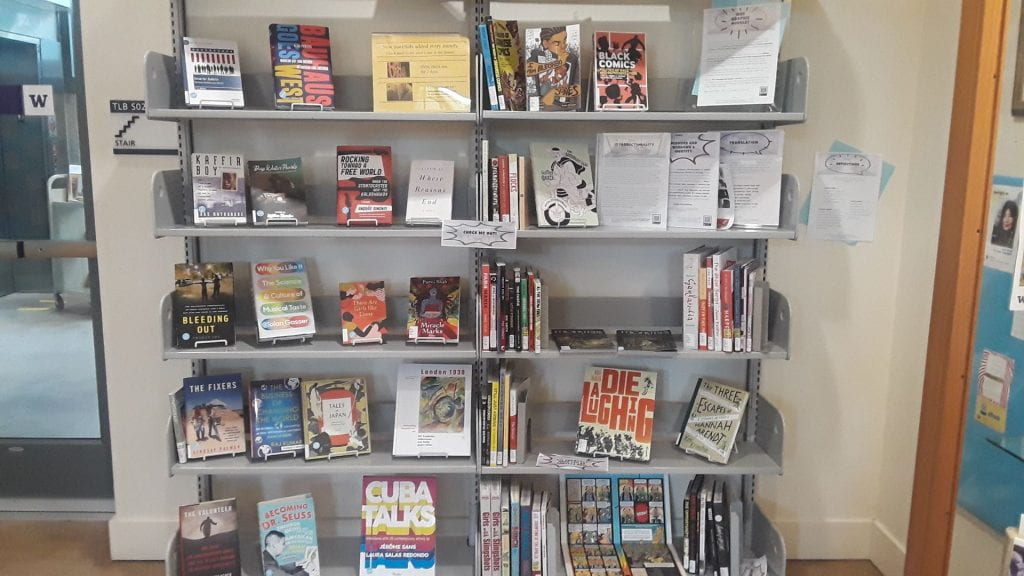
Generate point markers for all "becoming dr. seuss" book in the image. Your answer should be formatted as a list of tuples, i.e. [(x1, y1), (x2, y2), ...], where each tuple contains the x and y coordinates of a point satisfying the conditions above.

[(288, 511)]